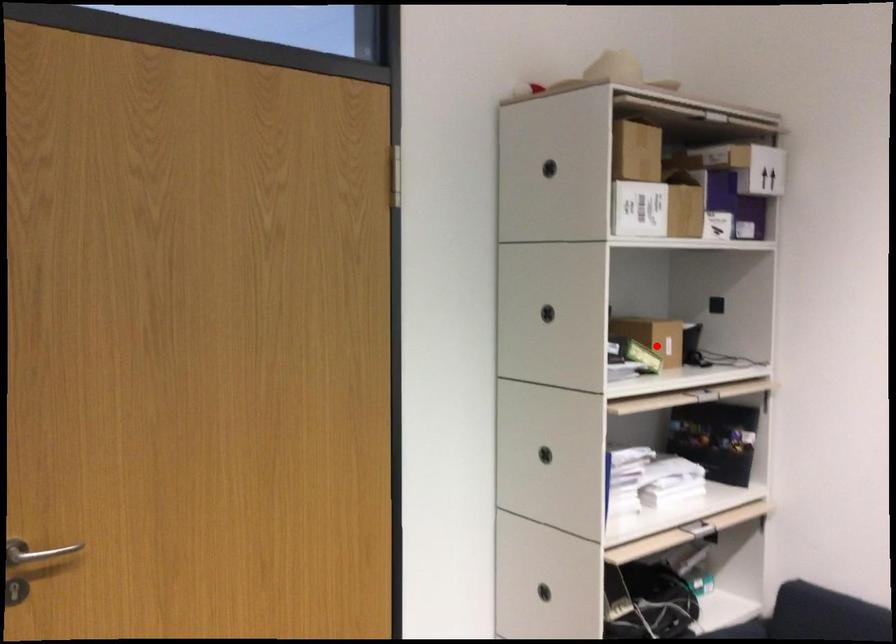
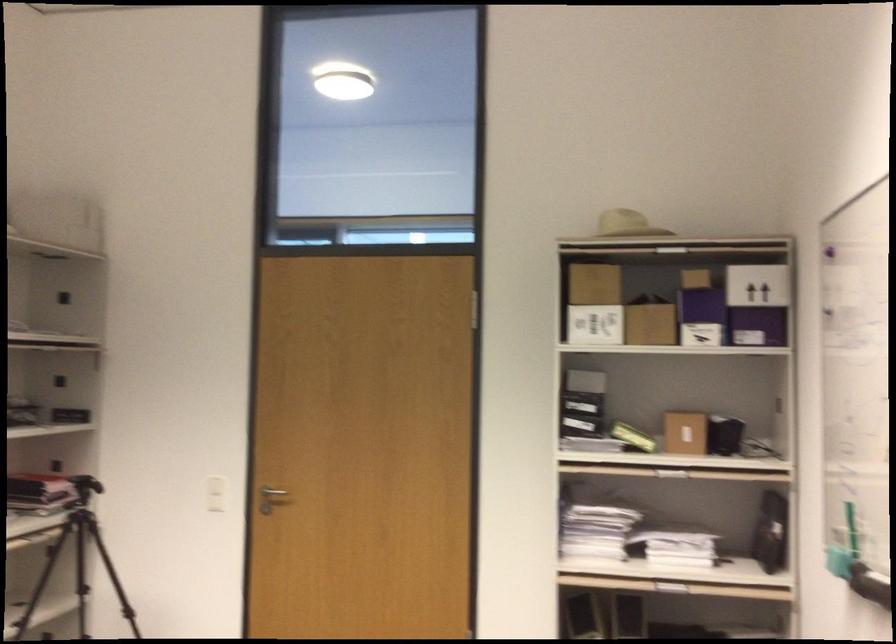
Question: I am providing you with two images of the same scene from different viewpoints. In image1, a red point is highlighted. Considering the same 3D point in image2, which of the following is correct?

Choices:
 (A) It is closer
 (B) It is farther

Answer: (B)